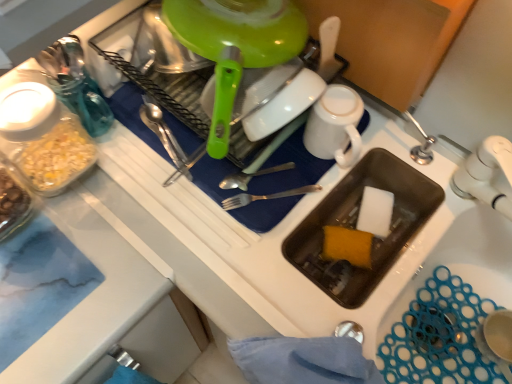
You are a GUI agent. You are given a task and a screenshot of the screen. Output one action in this format:
    pyautogui.click(x=<x>, y=<y>)
    Task: Click on the vacant area that is situated to the right of silver metallic fork at center
    The height and width of the screenshot is (384, 512).
    Given the screenshot: What is the action you would take?
    pyautogui.click(x=350, y=178)